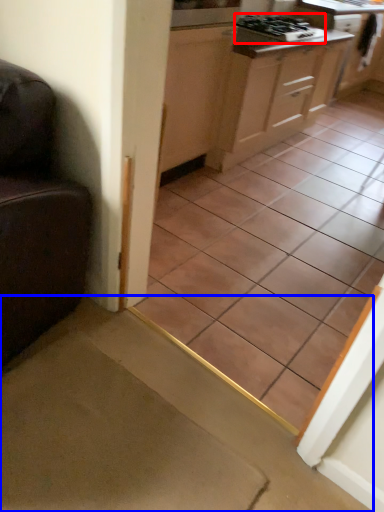
Question: Which object is further to the camera taking this photo, gas stove (highlighted by a red box) or stairwell (highlighted by a blue box)?

Choices:
 (A) gas stove
 (B) stairwell

Answer: (A)